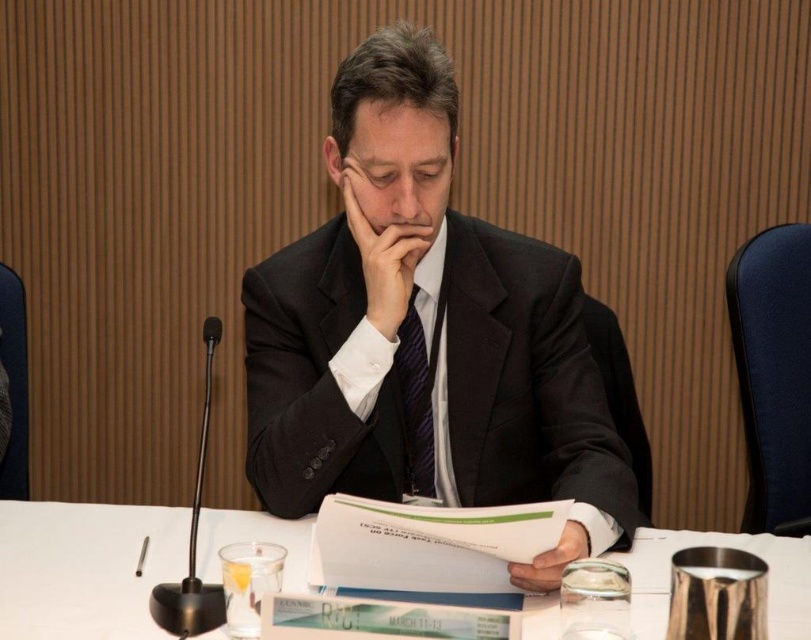
Does white paper at center have a larger size compared to matte black suit at center?

Actually, white paper at center might be smaller than matte black suit at center.

Who is positioned more to the right, white paper at center or matte black suit at center?

matte black suit at center is more to the right.

Locate an element on the screen. This screenshot has height=640, width=811. white paper at center is located at coordinates (84, 568).

Where is `white paper at center`? This screenshot has width=811, height=640. white paper at center is located at coordinates (84, 568).

Can you confirm if matte black suit at center is taller than matte black hand at center?

Yes.

Is point (436, 109) farther from camera compared to point (397, 326)?

No, (436, 109) is in front of (397, 326).

Image resolution: width=811 pixels, height=640 pixels. What are the coordinates of `matte black suit at center` in the screenshot? It's located at (393, 129).

Does dark blue striped tie at center have a lesser width compared to white matte paper at center?

Indeed, dark blue striped tie at center has a lesser width compared to white matte paper at center.

Does dark blue striped tie at center have a lesser height compared to white matte paper at center?

No.

At what (x,y) coordinates should I click in order to perform the action: click on dark blue striped tie at center. Please return your answer as a coordinate pair (x, y). Image resolution: width=811 pixels, height=640 pixels. Looking at the image, I should click on (415, 401).